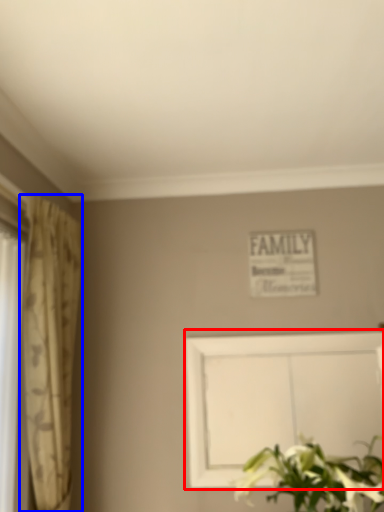
Question: Which point is closer to the camera, picture frame (highlighted by a red box) or curtain (highlighted by a blue box)?

Choices:
 (A) picture frame
 (B) curtain

Answer: (B)